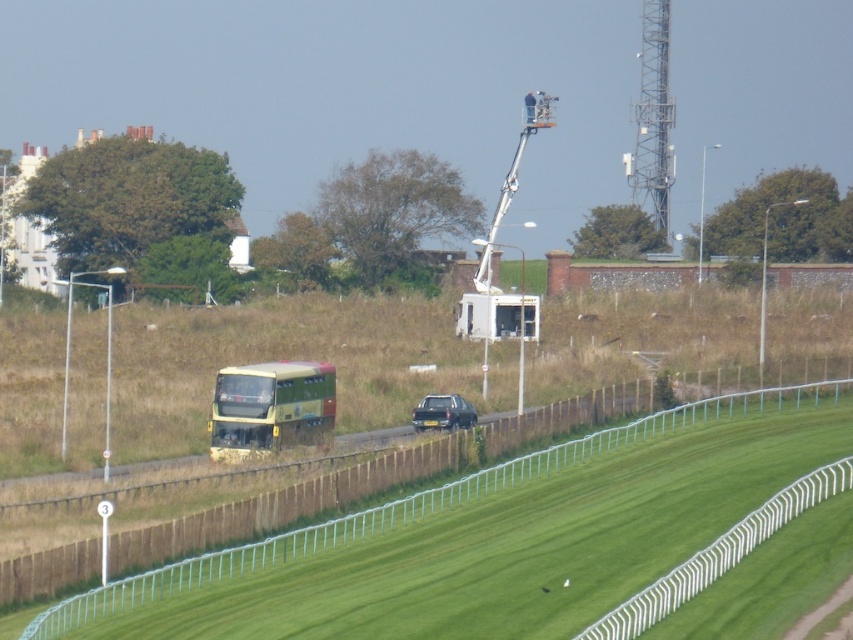
You are a drone operator planning to fly a drone from the metallic tower at upper right to the camera. The drone has a maximum range of 150 meters. Will it be able to reach the camera without needing a recharge?

The metallic tower at upper right and camera are 156.52 meters apart from each other. Since the drone has a maximum range of 150 meters, it will not be able to reach the camera without needing a recharge.

You are a photographer planning to take a photo of the metallic tower at upper right and the metallic silver car at center. Which object will appear larger in the photo?

The metallic tower at upper right will appear larger in the photo because it is much taller than the metallic silver car at center.

You are standing at the point with coordinates point (x=270, y=406) in the image. What object are you facing? Please answer with the object label from the objects list.

The point (x=270, y=406) corresponds to the yellow green metallic bus at center left.